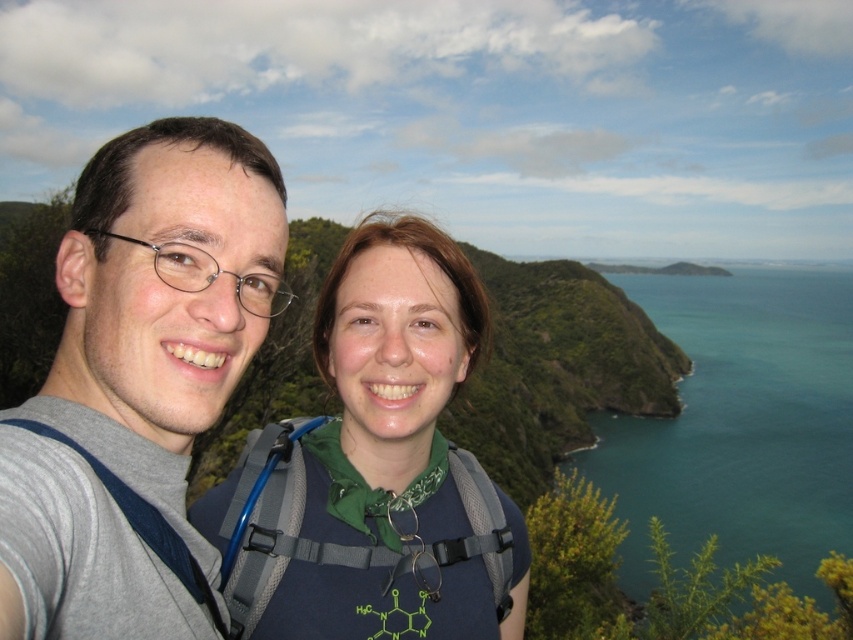
Does blue fabric backpack at center have a larger size compared to teal glossy water at upper right?

Actually, blue fabric backpack at center might be smaller than teal glossy water at upper right.

Based on the photo, is blue fabric backpack at center thinner than teal glossy water at upper right?

Indeed, blue fabric backpack at center has a lesser width compared to teal glossy water at upper right.

Find the location of a particular element. blue fabric backpack at center is located at coordinates (384, 465).

Who is higher up, gray fabric shirt at left or teal glossy water at upper right?

gray fabric shirt at left is above.

Is gray fabric shirt at left positioned behind teal glossy water at upper right?

No, gray fabric shirt at left is in front of teal glossy water at upper right.

Who is more distant from viewer, (148, 492) or (773, 499)?

Positioned behind is point (773, 499).

Find the location of a particular element. The width and height of the screenshot is (853, 640). gray fabric shirt at left is located at coordinates (138, 384).

Does gray fabric shirt at left have a lesser width compared to blue fabric backpack at center?

Yes.

Which is below, gray fabric shirt at left or blue fabric backpack at center?

Positioned lower is blue fabric backpack at center.

Does point (0, 467) come in front of point (459, 308)?

Yes, it is.

You are a GUI agent. You are given a task and a screenshot of the screen. Output one action in this format:
    pyautogui.click(x=<x>, y=<y>)
    Task: Click on the gray fabric shirt at left
    
    Given the screenshot: What is the action you would take?
    pyautogui.click(x=138, y=384)